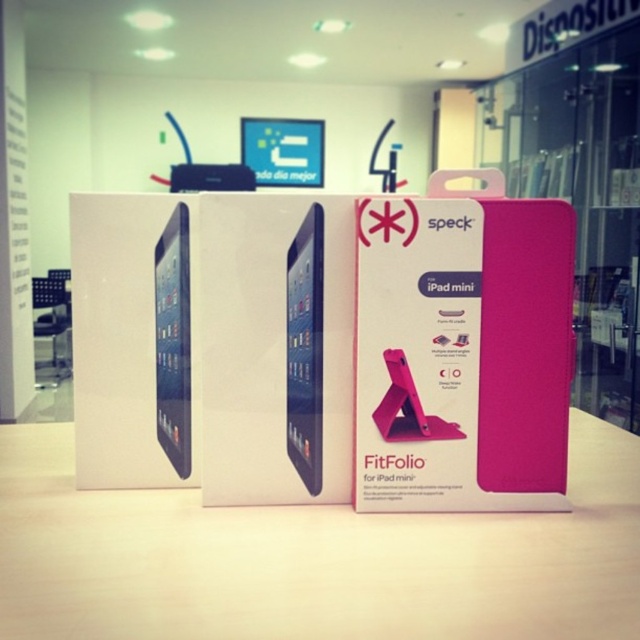
Question: Can you confirm if pink matte table at center is positioned to the right of matte black tablet at center?

Choices:
 (A) no
 (B) yes

Answer: (B)

Question: Based on their relative distances, which object is farther from the matte black tablet at left?

Choices:
 (A) matte black tablet at center
 (B) pink matte table at center

Answer: (B)

Question: Which is farther from the pink matte table at center?

Choices:
 (A) matte black tablet at center
 (B) matte black tablet at left

Answer: (B)

Question: Is pink matte table at center behind matte black tablet at left?

Choices:
 (A) no
 (B) yes

Answer: (A)

Question: Is pink matte table at center wider than matte black tablet at center?

Choices:
 (A) no
 (B) yes

Answer: (B)

Question: Which point is farther to the camera?

Choices:
 (A) (556, 525)
 (B) (308, 296)

Answer: (B)